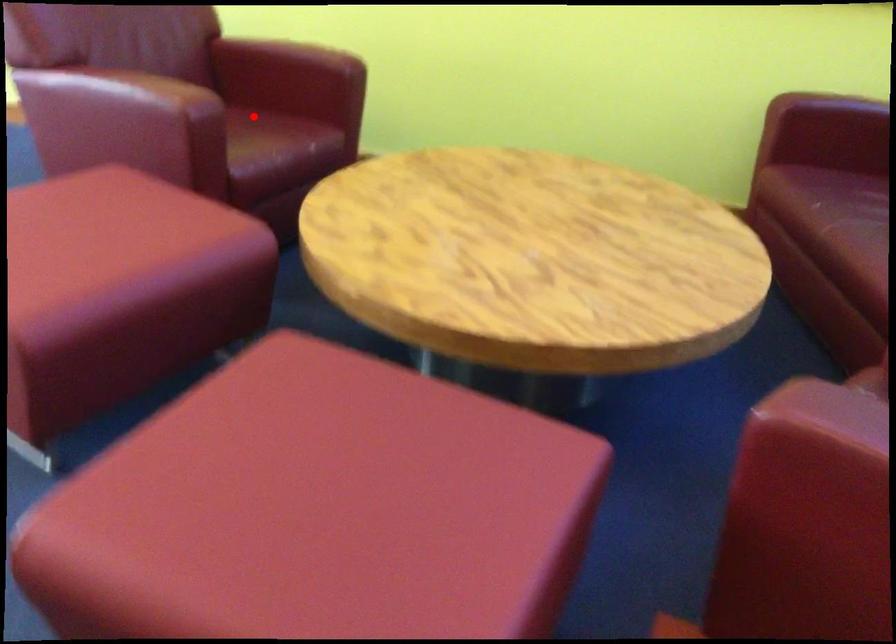
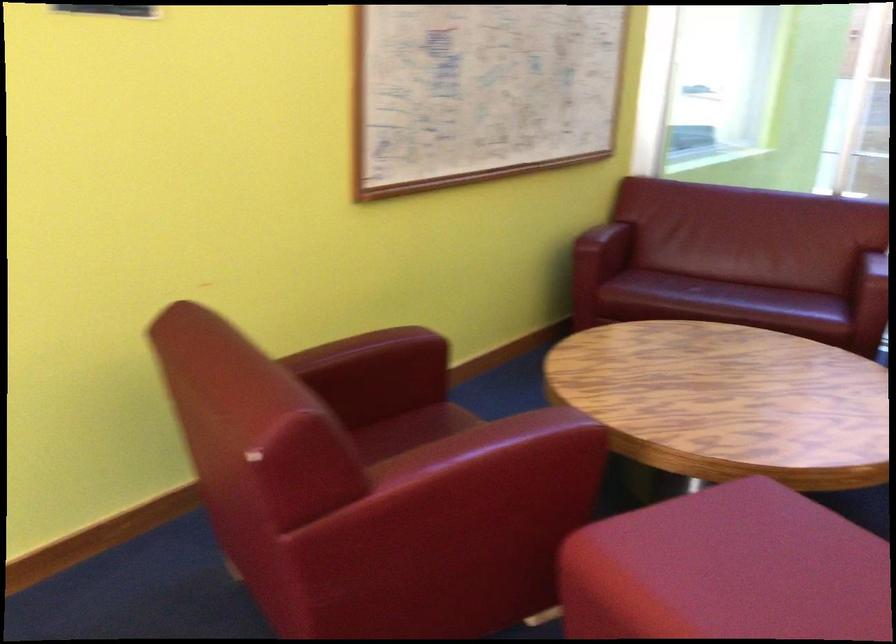
Question: A red point is marked in image1. In image2, is the corresponding 3D point closer to the camera or farther? Reply with the corresponding letter.

Choices:
 (A) The corresponding 3D point is closer.
 (B) The corresponding 3D point is farther.

Answer: (A)